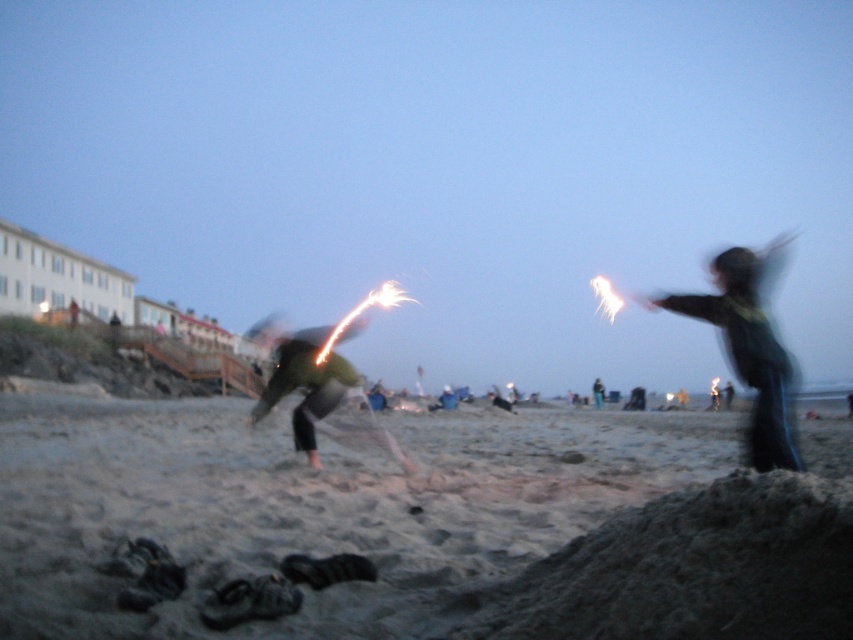
Question: Does fine-grained sand at lower center have a greater width compared to dark green fabric at right?

Choices:
 (A) no
 (B) yes

Answer: (B)

Question: Does fine-grained sand at lower center have a lesser width compared to green fabric jacket at center?

Choices:
 (A) yes
 (B) no

Answer: (B)

Question: Which of the following is the farthest from the observer?

Choices:
 (A) (405, 556)
 (B) (595, 388)
 (C) (782, 444)

Answer: (B)

Question: Estimate the real-world distances between objects in this image. Which object is farther from the fine-grained sand at lower center?

Choices:
 (A) dark green fabric at right
 (B) green fabric jacket at center

Answer: (B)

Question: Is fine-grained sand at lower center behind dark green fabric at right?

Choices:
 (A) no
 (B) yes

Answer: (A)

Question: Which object is closer to the camera taking this photo?

Choices:
 (A) fine-grained sand at lower center
 (B) dark green fabric at right
 (C) green fabric jacket at center

Answer: (A)